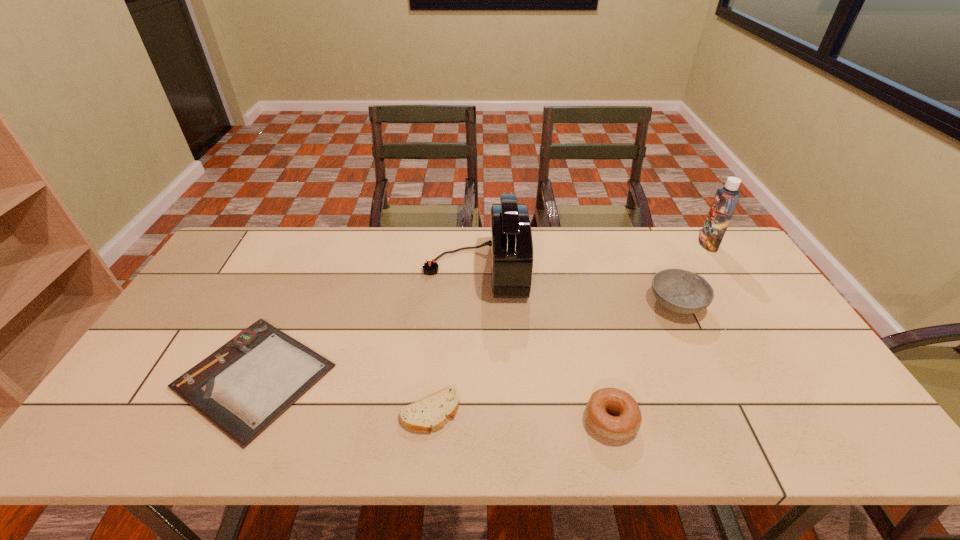
Identify the location of pita bread that is at the near edge. (431, 413).

Find the location of a particular element. The height and width of the screenshot is (540, 960). clipboard located in the near edge section of the desktop is located at coordinates (244, 386).

Identify the location of object that is positioned at the left edge. (244, 386).

Locate an element on the screen. The image size is (960, 540). object located in the right edge section of the desktop is located at coordinates (726, 199).

Locate an element on the screen. The height and width of the screenshot is (540, 960). object located in the near left corner section of the desktop is located at coordinates (244, 386).

Locate an element on the screen. This screenshot has width=960, height=540. object that is at the far right corner is located at coordinates (726, 199).

In the image, there is a desktop. Where is `vacant space at the far edge`? vacant space at the far edge is located at coordinates (384, 255).

Where is `free region at the near edge of the desktop`? This screenshot has width=960, height=540. free region at the near edge of the desktop is located at coordinates (307, 415).

At what (x,y) coordinates should I click in order to perform the action: click on free space at the left edge. Please return your answer as a coordinate pair (x, y). The width and height of the screenshot is (960, 540). Looking at the image, I should click on (205, 328).

Find the location of a particular element. The height and width of the screenshot is (540, 960). free space at the right edge is located at coordinates (832, 397).